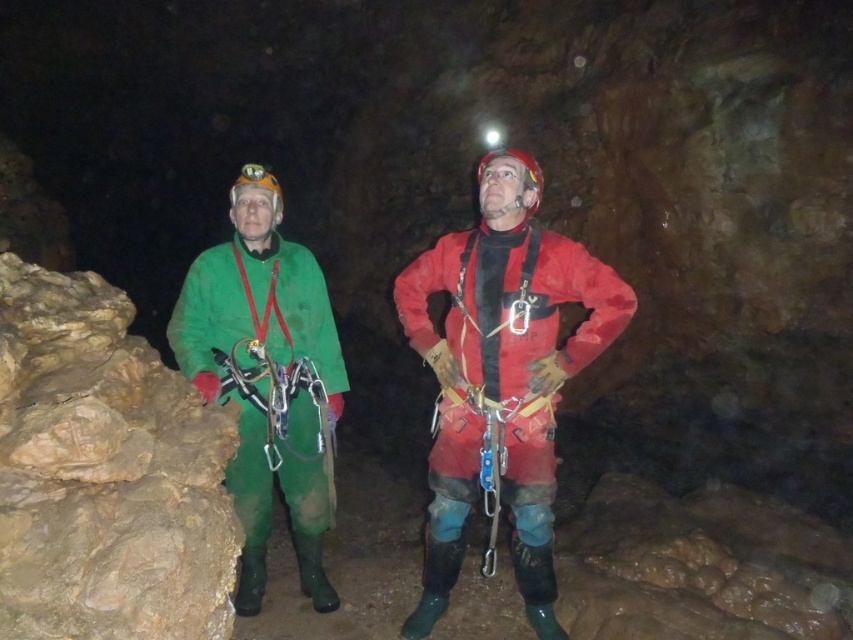
Question: Can you confirm if matte red jacket at center is bigger than green matte jacket at left?

Choices:
 (A) yes
 (B) no

Answer: (B)

Question: Which object is farther from the camera taking this photo?

Choices:
 (A) green matte jacket at left
 (B) matte red jacket at center

Answer: (B)

Question: Does matte red jacket at center come behind green matte jacket at left?

Choices:
 (A) no
 (B) yes

Answer: (B)

Question: Is matte red jacket at center closer to camera compared to green matte jacket at left?

Choices:
 (A) yes
 (B) no

Answer: (B)

Question: Which object is farther from the camera taking this photo?

Choices:
 (A) green matte jacket at left
 (B) matte red jacket at center

Answer: (B)

Question: Which object appears closest to the camera in this image?

Choices:
 (A) green matte jacket at left
 (B) matte red jacket at center

Answer: (A)